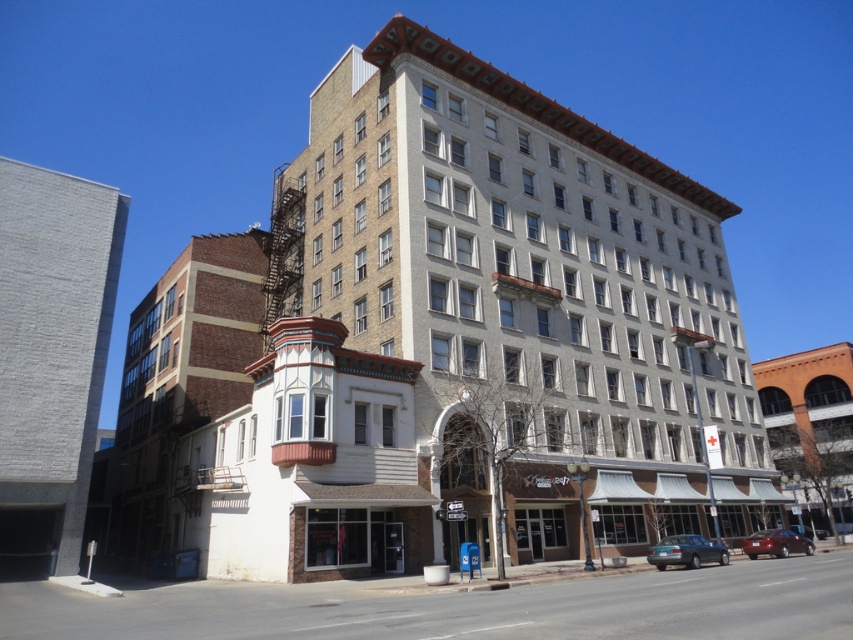
This screenshot has height=640, width=853. Find the location of `gray brick building at left`. gray brick building at left is located at coordinates (51, 356).

Is gray brick building at left wider than matte black sedan at lower center?

Incorrect, gray brick building at left's width does not surpass matte black sedan at lower center's.

Between point (70, 461) and point (666, 548), which one is positioned in front?

Point (666, 548)

The height and width of the screenshot is (640, 853). Find the location of `gray brick building at left`. gray brick building at left is located at coordinates (51, 356).

From the picture: Between beige stone building at center and brown brick building at left, which one is positioned higher?

beige stone building at center is above.

Identify the location of beige stone building at center. (527, 292).

Image resolution: width=853 pixels, height=640 pixels. In order to click on beige stone building at center in this screenshot , I will do `click(527, 292)`.

Find the location of a particular element. The image size is (853, 640). beige stone building at center is located at coordinates (527, 292).

Which is behind, point (154, 545) or point (709, 544)?

Point (154, 545)

Is point (263, 264) positioned behind point (670, 552)?

Yes, it is behind point (670, 552).

Where is `brown brick building at left`? This screenshot has height=640, width=853. brown brick building at left is located at coordinates (181, 380).